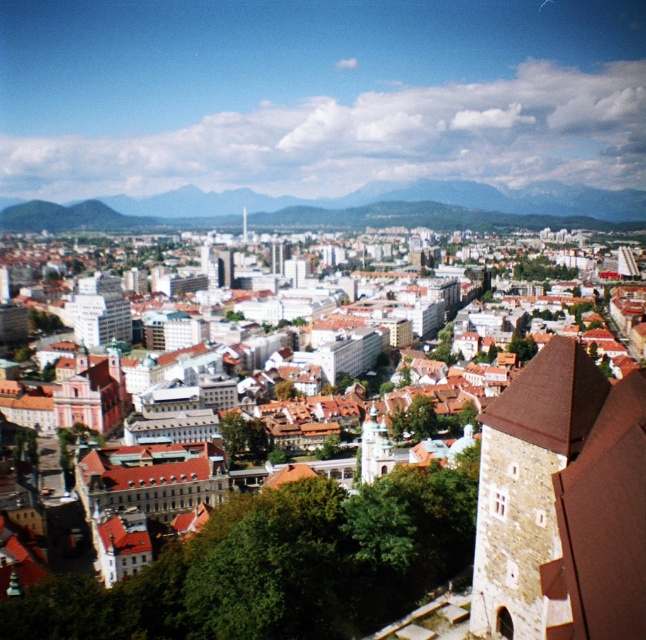
You are a city planner analyzing the layout of this area. You need to determine which object takes up more visual space in the image between the brown stone tower at right and the green grassy hill at center. Which one occupies a larger portion of the scene?

The green grassy hill at center occupies a larger portion of the scene than the brown stone tower at right because the brown stone tower at right occupies less space than green grassy hill at center.

You are standing at the viewpoint where the image was taken and want to take a photo of both point (568,378) and point (286,209). Considering their positions, which point will appear larger in your photo?

Point (568,378) is closer to the camera than point (286,209), so it will appear larger in the photo.